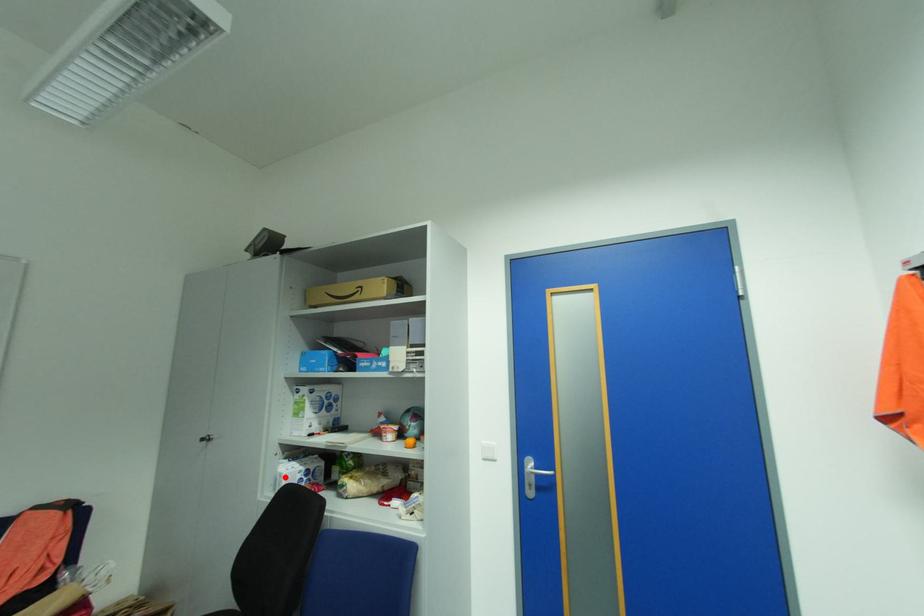
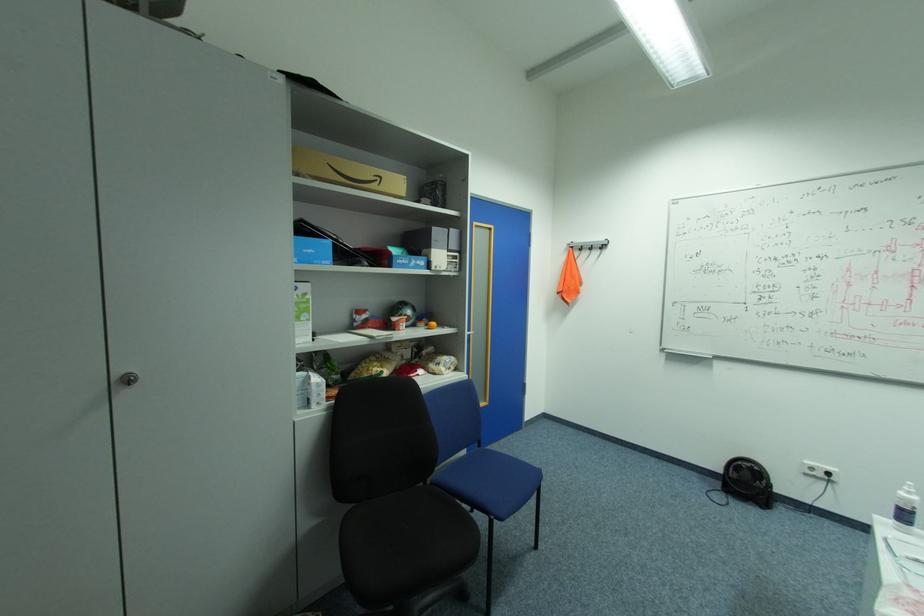
In the second image, find the point that corresponds to the highlighted location in the first image.

(321, 387)